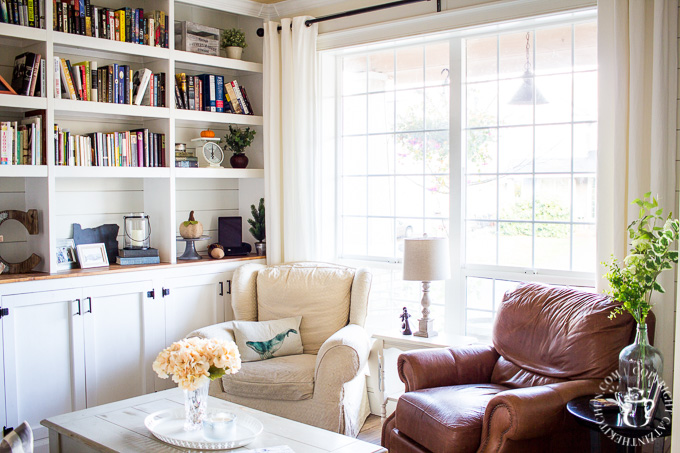
Identify the location of curtain. The image size is (680, 453). (294, 112), (634, 116).